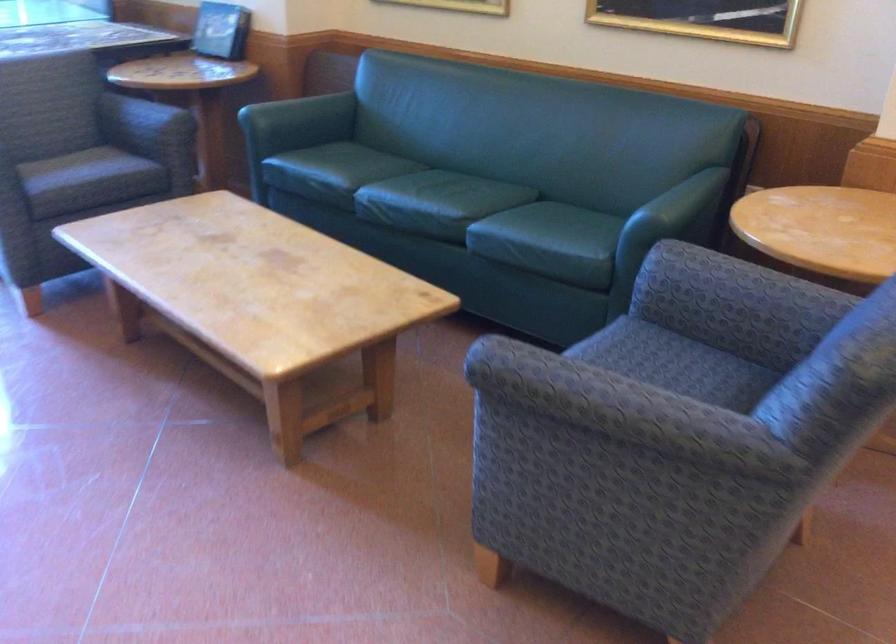
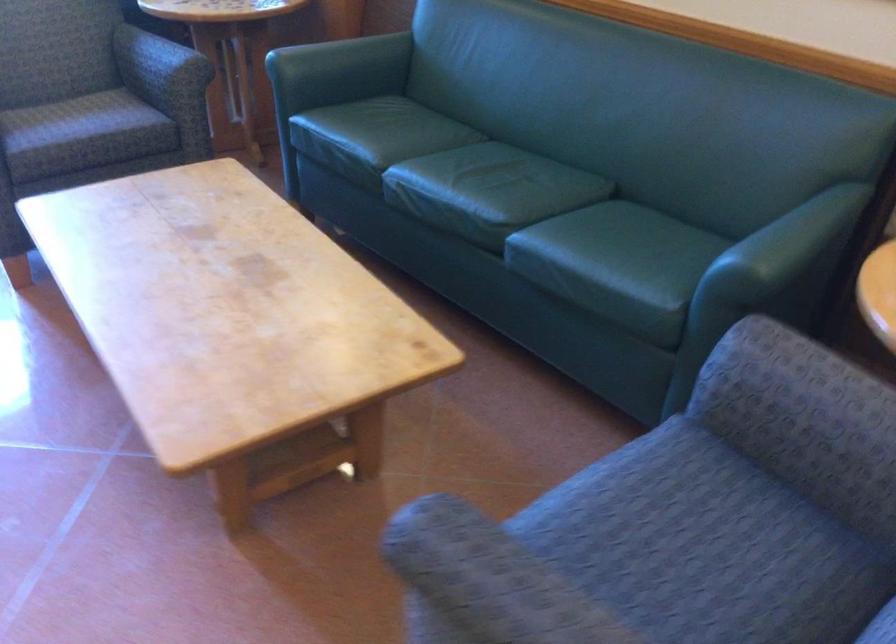
In a continuous first-person perspective shot, in which direction is the camera moving?

The cameraman walked toward right, forward.